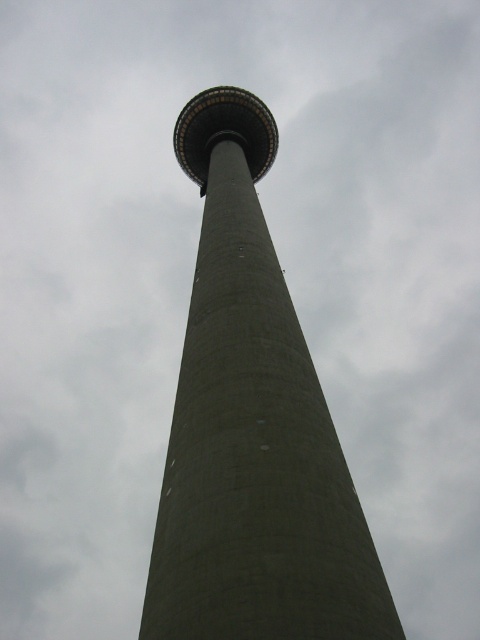
Question: Does gray concrete tower at center lie in front of concrete tower at center?

Choices:
 (A) yes
 (B) no

Answer: (A)

Question: Is gray concrete tower at center in front of concrete tower at center?

Choices:
 (A) yes
 (B) no

Answer: (A)

Question: Which object is farther from the camera taking this photo?

Choices:
 (A) gray concrete tower at center
 (B) concrete tower at center

Answer: (B)

Question: Is gray concrete tower at center above concrete tower at center?

Choices:
 (A) no
 (B) yes

Answer: (A)

Question: Which point appears farthest from the camera in this image?

Choices:
 (A) (245, 614)
 (B) (224, 131)

Answer: (B)